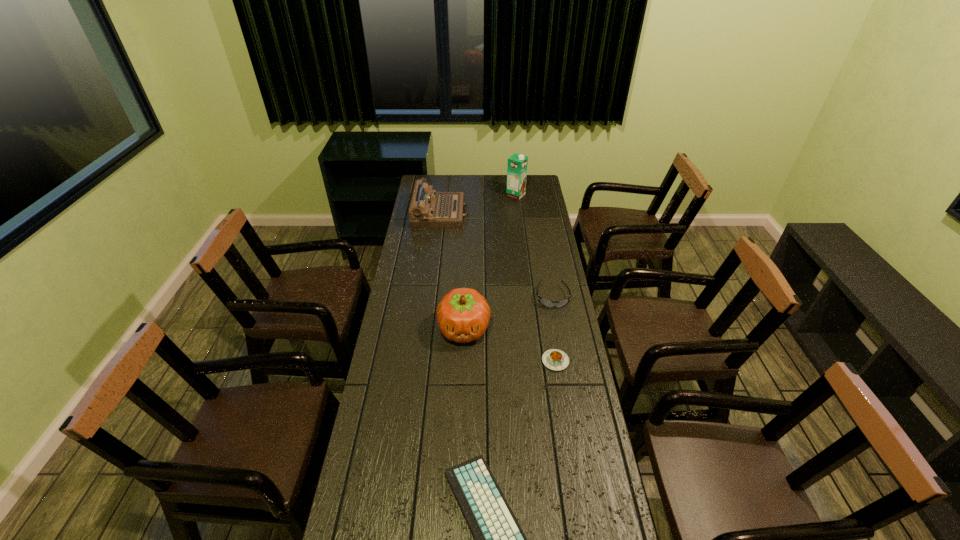
This screenshot has height=540, width=960. Identify the location of object that is at the far edge. (517, 165).

Find the location of a particular element. The width and height of the screenshot is (960, 540). object located at the left edge is located at coordinates (428, 209).

You are a GUI agent. You are given a task and a screenshot of the screen. Output one action in this format:
    pyautogui.click(x=<x>, y=<y>)
    Task: Click on the carton that is at the right edge
    Image resolution: width=960 pixels, height=540 pixels.
    Given the screenshot: What is the action you would take?
    pyautogui.click(x=517, y=165)

At what (x,y) coordinates should I click in order to perform the action: click on sunglasses that is at the right edge. Please return your answer as a coordinate pair (x, y). Looking at the image, I should click on pos(546,303).

Identify the location of pudding located at the right edge. (554, 359).

The height and width of the screenshot is (540, 960). I want to click on object that is at the far right corner, so click(x=517, y=165).

Image resolution: width=960 pixels, height=540 pixels. I want to click on free location at the far edge, so click(x=483, y=185).

In the image, there is a desktop. In order to click on free space at the left edge in this screenshot , I will do `click(408, 225)`.

At what (x,y) coordinates should I click in order to perform the action: click on free spot at the right edge of the desktop. Please return your answer as a coordinate pair (x, y). Looking at the image, I should click on (549, 368).

What are the coordinates of `free space between the third shortest object and the pumpkin` in the screenshot? It's located at click(508, 313).